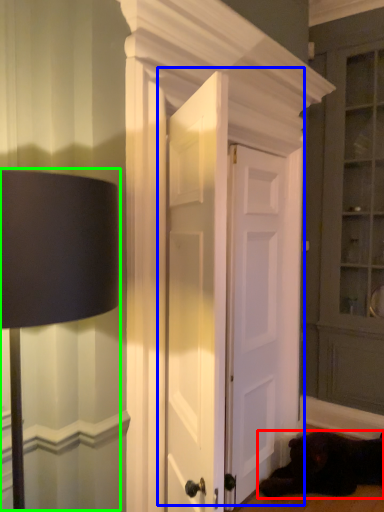
Question: Which is nearer to the dog (highlighted by a red box)? door (highlighted by a blue box) or table lamp (highlighted by a green box).

Choices:
 (A) door
 (B) table lamp

Answer: (A)